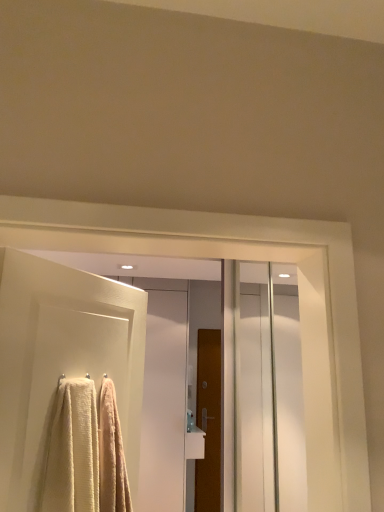
Question: Is soft white towel at left at the left side of white textured towel at left, which ranks as the 2th door in right-to-left order?

Choices:
 (A) yes
 (B) no

Answer: (B)

Question: From the image's perspective, is soft white towel at left over white textured towel at left, the first door in the front-to-back sequence?

Choices:
 (A) yes
 (B) no

Answer: (B)

Question: Would you say soft white towel at left contains white textured towel at left, the 1th door viewed from the left?

Choices:
 (A) no
 (B) yes

Answer: (A)

Question: Is soft white towel at left to the right of white textured towel at left, the first door in the front-to-back sequence, from the viewer's perspective?

Choices:
 (A) no
 (B) yes

Answer: (B)

Question: Is the depth of soft white towel at left less than that of white textured towel at left, which is the 2th door from back to front?

Choices:
 (A) yes
 (B) no

Answer: (B)

Question: In the image, is white glossy screen door at center on the left side or the right side of white textured towel at left, which ranks as the 2th door in right-to-left order?

Choices:
 (A) right
 (B) left

Answer: (B)

Question: From the image's perspective, is white glossy screen door at center located above or below white textured towel at left, the first door in the front-to-back sequence?

Choices:
 (A) above
 (B) below

Answer: (B)

Question: Based on their sizes in the image, would you say white glossy screen door at center is bigger or smaller than white textured towel at left, which is the 2th door from back to front?

Choices:
 (A) big
 (B) small

Answer: (A)

Question: Which is correct: white glossy screen door at center is inside white textured towel at left, arranged as the 2th door when ordered from the bottom, or outside of it?

Choices:
 (A) outside
 (B) inside

Answer: (A)

Question: In terms of height, does soft white towel at left look taller or shorter compared to white textured towel at left, arranged as the 2th door when ordered from the bottom?

Choices:
 (A) tall
 (B) short

Answer: (B)

Question: Is soft white towel at left bigger or smaller than white textured towel at left, which is the first door in top-to-bottom order?

Choices:
 (A) big
 (B) small

Answer: (B)

Question: In terms of width, does soft white towel at left look wider or thinner when compared to white textured towel at left, which is the 2th door from back to front?

Choices:
 (A) thin
 (B) wide

Answer: (B)

Question: From the image's perspective, is soft white towel at left positioned above or below white textured towel at left, the 1th door viewed from the left?

Choices:
 (A) below
 (B) above

Answer: (A)

Question: In terms of width, does brown wooden door at center, placed as the first door when sorted from right to left, look wider or thinner when compared to white textured towel at left, which is the 2th door from back to front?

Choices:
 (A) thin
 (B) wide

Answer: (B)

Question: Is brown wooden door at center, the first door when ordered from back to front, in front of or behind white textured towel at left, the first door in the front-to-back sequence, in the image?

Choices:
 (A) behind
 (B) front

Answer: (A)